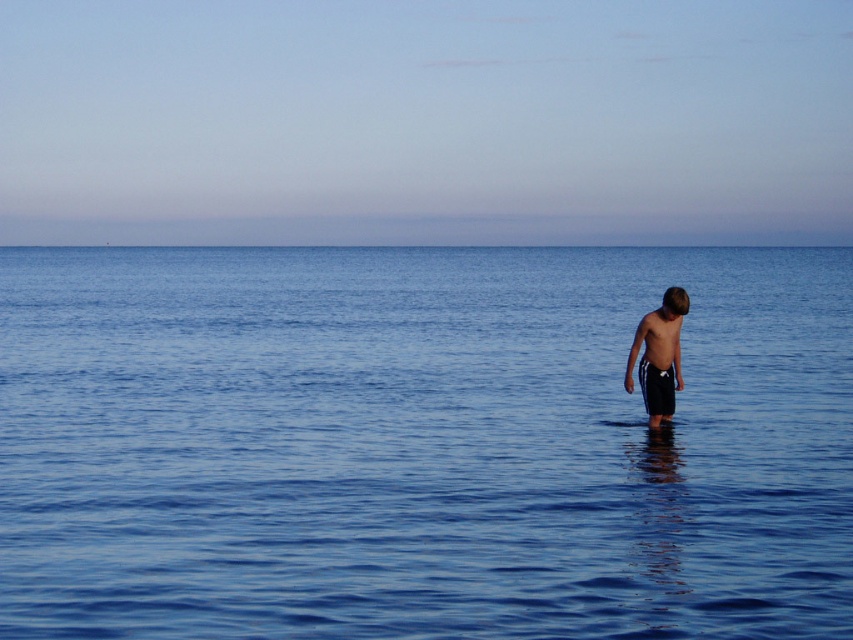
Question: Is blue smooth water at center closer to camera compared to dark blue shorts at center?

Choices:
 (A) yes
 (B) no

Answer: (A)

Question: Estimate the real-world distances between objects in this image. Which object is farther from the dark blue shorts at center?

Choices:
 (A) blue smooth water at center
 (B) blue smooth water at upper center

Answer: (B)

Question: Does blue smooth water at center have a greater width compared to blue smooth water at upper center?

Choices:
 (A) yes
 (B) no

Answer: (B)

Question: Which of the following is the farthest from the observer?

Choices:
 (A) blue smooth water at upper center
 (B) dark blue shorts at center

Answer: (A)

Question: Which point appears closest to the camera in this image?

Choices:
 (A) (675, 342)
 (B) (252, 300)

Answer: (A)

Question: Does blue smooth water at upper center have a larger size compared to dark blue shorts at center?

Choices:
 (A) yes
 (B) no

Answer: (A)